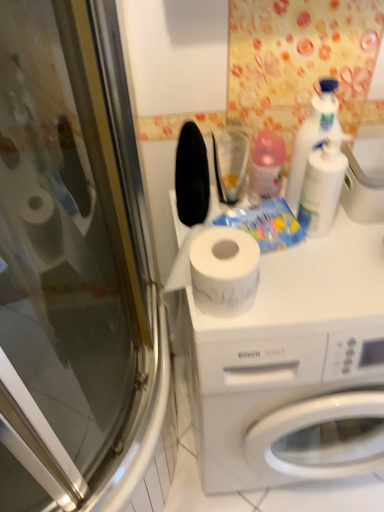
The image size is (384, 512). What do you see at coordinates (322, 186) in the screenshot?
I see `white plastic bottle at upper right, the second cleaning product viewed from the left` at bounding box center [322, 186].

Find the location of `white plastic bottle at upper right, which is the 3th cleaning product in left-to-right order`. white plastic bottle at upper right, which is the 3th cleaning product in left-to-right order is located at coordinates (312, 137).

Find the location of `transparent glass screen door at left`. transparent glass screen door at left is located at coordinates coord(76,276).

From a real-world perspective, between pink plastic bottle at upper center, the third cleaning product when ordered from right to left, and transparent glass screen door at left, who is vertically higher?

pink plastic bottle at upper center, the third cleaning product when ordered from right to left, from a real-world perspective.

Is pink plastic bottle at upper center, marked as the first cleaning product in a left-to-right arrangement, at the right side of transparent glass screen door at left?

Yes, pink plastic bottle at upper center, marked as the first cleaning product in a left-to-right arrangement, is to the right of transparent glass screen door at left.

What's the angular difference between pink plastic bottle at upper center, marked as the first cleaning product in a left-to-right arrangement, and transparent glass screen door at left's facing directions?

89 degrees separate the facing orientations of pink plastic bottle at upper center, marked as the first cleaning product in a left-to-right arrangement, and transparent glass screen door at left.

Is pink plastic bottle at upper center, the third cleaning product when ordered from right to left, bigger than transparent glass screen door at left?

No, pink plastic bottle at upper center, the third cleaning product when ordered from right to left, is not bigger than transparent glass screen door at left.

Can you tell me how much white matte washing machine at center and white plastic bottle at upper right, which is the 3th cleaning product in left-to-right order, differ in facing direction?

0.588 degrees.

Could white plastic bottle at upper right, marked as the first cleaning product in a right-to-left arrangement, be considered to be inside white matte washing machine at center?

No, white plastic bottle at upper right, marked as the first cleaning product in a right-to-left arrangement, is not a part of white matte washing machine at center.

Based on the photo, is white matte washing machine at center to the left of white plastic bottle at upper right, which is the 3th cleaning product in left-to-right order, from the viewer's perspective?

In fact, white matte washing machine at center is to the right of white plastic bottle at upper right, which is the 3th cleaning product in left-to-right order.

Are white plastic bottle at upper right, which appears as the 2th cleaning product when viewed from the right, and white matte washing machine at center beside each other?

No.

Can you confirm if white plastic bottle at upper right, which appears as the 2th cleaning product when viewed from the right, is smaller than white matte washing machine at center?

Indeed, white plastic bottle at upper right, which appears as the 2th cleaning product when viewed from the right, has a smaller size compared to white matte washing machine at center.

Which object is thinner, white plastic soap dispenser at upper right or white plastic bottle at upper right, which appears as the 2th cleaning product when viewed from the right?

white plastic bottle at upper right, which appears as the 2th cleaning product when viewed from the right, is thinner.

Is white plastic soap dispenser at upper right bigger or smaller than white plastic bottle at upper right, which appears as the 2th cleaning product when viewed from the right?

Considering their sizes, white plastic soap dispenser at upper right takes up more space than white plastic bottle at upper right, which appears as the 2th cleaning product when viewed from the right.

Identify the location of the 2nd cleaning product in front when counting from the white plastic soap dispenser at upper right. (322, 186).

Could you tell me if white plastic soap dispenser at upper right is turned towards white plastic bottle at upper right, which appears as the 2th cleaning product when viewed from the right?

No, white plastic soap dispenser at upper right does not turn towards white plastic bottle at upper right, which appears as the 2th cleaning product when viewed from the right.

Are white plastic bottle at upper right, the second cleaning product viewed from the left, and white plastic bottle at upper right, marked as the first cleaning product in a right-to-left arrangement, far apart?

No, white plastic bottle at upper right, the second cleaning product viewed from the left, is not far from white plastic bottle at upper right, marked as the first cleaning product in a right-to-left arrangement.

Would you say white plastic bottle at upper right, which appears as the 2th cleaning product when viewed from the right, is to the left or to the right of white plastic bottle at upper right, marked as the first cleaning product in a right-to-left arrangement, in the picture?

white plastic bottle at upper right, which appears as the 2th cleaning product when viewed from the right, is to the left of white plastic bottle at upper right, marked as the first cleaning product in a right-to-left arrangement.

Relative to white plastic bottle at upper right, marked as the first cleaning product in a right-to-left arrangement, is white plastic bottle at upper right, the second cleaning product viewed from the left, in front or behind?

Visually, white plastic bottle at upper right, the second cleaning product viewed from the left, is located in front of white plastic bottle at upper right, marked as the first cleaning product in a right-to-left arrangement.

Considering the positions of point (307, 233) and point (315, 114), is point (307, 233) closer or farther from the camera than point (315, 114)?

Point (307, 233) appears to be farther away from the viewer than point (315, 114).

Could you measure the distance between white plastic bottle at upper right, marked as the first cleaning product in a right-to-left arrangement, and transparent glass screen door at left?

A distance of 25.42 inches exists between white plastic bottle at upper right, marked as the first cleaning product in a right-to-left arrangement, and transparent glass screen door at left.

Identify the location of the 3rd cleaning product located above the transparent glass screen door at left (from a real-world perspective). Image resolution: width=384 pixels, height=512 pixels. (312, 137).

Is transparent glass screen door at left inside white plastic bottle at upper right, which is the 3th cleaning product in left-to-right order?

No, white plastic bottle at upper right, which is the 3th cleaning product in left-to-right order, does not contain transparent glass screen door at left.

Considering the relative positions of white plastic bottle at upper right, which is the 3th cleaning product in left-to-right order, and pink plastic bottle at upper center, the third cleaning product when ordered from right to left, in the image provided, is white plastic bottle at upper right, which is the 3th cleaning product in left-to-right order, to the right of pink plastic bottle at upper center, the third cleaning product when ordered from right to left, from the viewer's perspective?

Yes, white plastic bottle at upper right, which is the 3th cleaning product in left-to-right order, is to the right of pink plastic bottle at upper center, the third cleaning product when ordered from right to left.

Between white plastic bottle at upper right, marked as the first cleaning product in a right-to-left arrangement, and pink plastic bottle at upper center, the third cleaning product when ordered from right to left, which one has smaller size?

white plastic bottle at upper right, marked as the first cleaning product in a right-to-left arrangement.

Are white plastic bottle at upper right, which is the 3th cleaning product in left-to-right order, and pink plastic bottle at upper center, the third cleaning product when ordered from right to left, making contact?

Absolutely, white plastic bottle at upper right, which is the 3th cleaning product in left-to-right order, is next to and touching pink plastic bottle at upper center, the third cleaning product when ordered from right to left.

Locate an element on the screen. This screenshot has height=512, width=384. screen door beneath the pink plastic bottle at upper center, marked as the first cleaning product in a left-to-right arrangement (from a real-world perspective) is located at coordinates (76, 276).

Identify the location of washing machine below the white plastic bottle at upper right, which is the 3th cleaning product in left-to-right order (from the image's perspective). Image resolution: width=384 pixels, height=512 pixels. (x=289, y=362).

Looking at this image, from the image, which object appears to be nearer to transparent glass screen door at left, pink plastic bottle at upper center, the third cleaning product when ordered from right to left, or white plastic bottle at upper right, which appears as the 2th cleaning product when viewed from the right?

Among the two, pink plastic bottle at upper center, the third cleaning product when ordered from right to left, is located nearer to transparent glass screen door at left.

Based on their spatial positions, is white matte washing machine at center or white plastic soap dispenser at upper right closer to pink plastic bottle at upper center, the third cleaning product when ordered from right to left?

The object closer to pink plastic bottle at upper center, the third cleaning product when ordered from right to left, is white plastic soap dispenser at upper right.

Looking at the image, which one is located closer to white plastic bottle at upper right, the second cleaning product viewed from the left, pink plastic bottle at upper center, marked as the first cleaning product in a left-to-right arrangement, or white matte washing machine at center?

Based on the image, pink plastic bottle at upper center, marked as the first cleaning product in a left-to-right arrangement, appears to be nearer to white plastic bottle at upper right, the second cleaning product viewed from the left.

Estimate the real-world distances between objects in this image. Which object is further from white plastic bottle at upper right, which appears as the 2th cleaning product when viewed from the right, white plastic soap dispenser at upper right or transparent glass screen door at left?

transparent glass screen door at left is further to white plastic bottle at upper right, which appears as the 2th cleaning product when viewed from the right.

Based on their spatial positions, is white plastic soap dispenser at upper right or white plastic bottle at upper right, the second cleaning product viewed from the left, further from pink plastic bottle at upper center, marked as the first cleaning product in a left-to-right arrangement?

Among the two, white plastic soap dispenser at upper right is located further to pink plastic bottle at upper center, marked as the first cleaning product in a left-to-right arrangement.

Estimate the real-world distances between objects in this image. Which object is further from white plastic soap dispenser at upper right, white plastic bottle at upper right, which is the 3th cleaning product in left-to-right order, or pink plastic bottle at upper center, the third cleaning product when ordered from right to left?

pink plastic bottle at upper center, the third cleaning product when ordered from right to left, lies further to white plastic soap dispenser at upper right than the other object.

When comparing their distances from pink plastic bottle at upper center, marked as the first cleaning product in a left-to-right arrangement, does white plastic bottle at upper right, which is the 3th cleaning product in left-to-right order, or transparent glass screen door at left seem closer?

white plastic bottle at upper right, which is the 3th cleaning product in left-to-right order, is closer to pink plastic bottle at upper center, marked as the first cleaning product in a left-to-right arrangement.

Based on the photo, when comparing their distances from pink plastic bottle at upper center, marked as the first cleaning product in a left-to-right arrangement, does white plastic bottle at upper right, which is the 3th cleaning product in left-to-right order, or white plastic bottle at upper right, which appears as the 2th cleaning product when viewed from the right, seem closer?

white plastic bottle at upper right, which is the 3th cleaning product in left-to-right order, is positioned closer to the anchor pink plastic bottle at upper center, marked as the first cleaning product in a left-to-right arrangement.

Identify the location of appliance between pink plastic bottle at upper center, marked as the first cleaning product in a left-to-right arrangement, and white matte washing machine at center in the up-down direction. (365, 176).

You are a GUI agent. You are given a task and a screenshot of the screen. Output one action in this format:
    pyautogui.click(x=<x>, y=<y>)
    Task: Click on the washing machine between transparent glass screen door at left and pink plastic bottle at upper center, the third cleaning product when ordered from right to left, along the z-axis
    
    Given the screenshot: What is the action you would take?
    pyautogui.click(x=289, y=362)

Where is `cleaning product between pink plastic bottle at upper center, marked as the first cleaning product in a left-to-right arrangement, and white matte washing machine at center from top to bottom`? This screenshot has height=512, width=384. cleaning product between pink plastic bottle at upper center, marked as the first cleaning product in a left-to-right arrangement, and white matte washing machine at center from top to bottom is located at coordinates [x=322, y=186].

You are a GUI agent. You are given a task and a screenshot of the screen. Output one action in this format:
    pyautogui.click(x=<x>, y=<y>)
    Task: Click on the cleaning product between white plastic soap dispenser at upper right and white matte washing machine at center in the vertical direction
    The height and width of the screenshot is (512, 384).
    Given the screenshot: What is the action you would take?
    pyautogui.click(x=322, y=186)